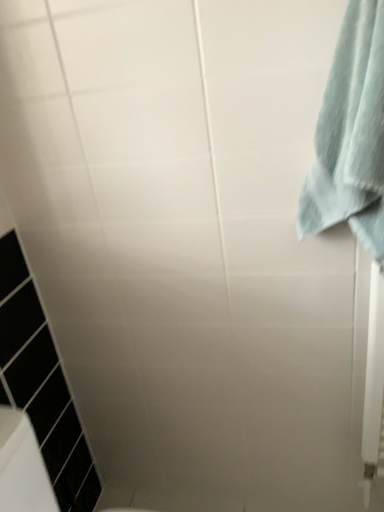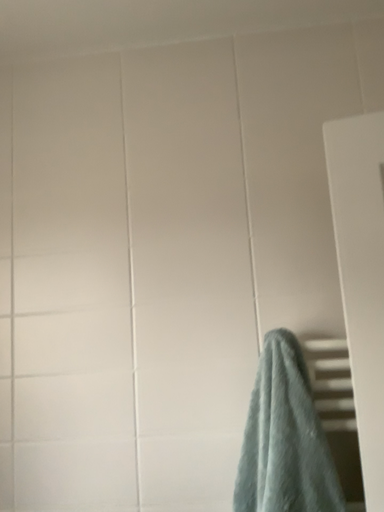
Question: Which way did the camera rotate in the video?

Choices:
 (A) rotated left
 (B) rotated right

Answer: (B)